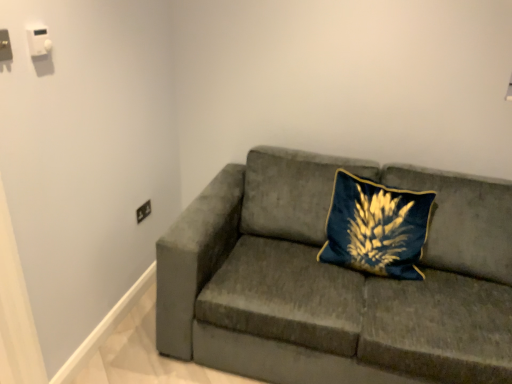
Question: From a real-world perspective, is velvet gray couch at center on top of black plastic electrical outlet at lower left, which ranks as the 3th electric outlet in front-to-back order?

Choices:
 (A) yes
 (B) no

Answer: (B)

Question: From the image's perspective, would you say velvet gray couch at center is shown under black plastic electrical outlet at lower left, marked as the third electric outlet in a top-to-bottom arrangement?

Choices:
 (A) yes
 (B) no

Answer: (A)

Question: Is the position of velvet gray couch at center less distant than that of black plastic electrical outlet at lower left, arranged as the 3th electric outlet when viewed from the left?

Choices:
 (A) no
 (B) yes

Answer: (B)

Question: Is the surface of velvet gray couch at center in direct contact with black plastic electrical outlet at lower left, placed as the first electric outlet when sorted from bottom to top?

Choices:
 (A) no
 (B) yes

Answer: (A)

Question: Would you consider velvet gray couch at center to be distant from black plastic electrical outlet at lower left, arranged as the 3th electric outlet when viewed from the left?

Choices:
 (A) yes
 (B) no

Answer: (A)

Question: Looking at the image, does white plastic switch at upper left, which is the second electric outlet from right to left, seem bigger or smaller compared to black plastic electrical outlet at lower left, which ranks as the 3th electric outlet in front-to-back order?

Choices:
 (A) small
 (B) big

Answer: (A)

Question: In the image, is white plastic switch at upper left, which ranks as the 2th electric outlet in left-to-right order, positioned in front of or behind black plastic electrical outlet at lower left, arranged as the 3th electric outlet when viewed from the left?

Choices:
 (A) behind
 (B) front

Answer: (B)

Question: Considering the positions of white plastic switch at upper left, acting as the second electric outlet starting from the back, and black plastic electrical outlet at lower left, marked as the third electric outlet in a top-to-bottom arrangement, in the image, is white plastic switch at upper left, acting as the second electric outlet starting from the back, wider or thinner than black plastic electrical outlet at lower left, marked as the third electric outlet in a top-to-bottom arrangement,?

Choices:
 (A) wide
 (B) thin

Answer: (A)

Question: Visually, is white plastic switch at upper left, placed as the first electric outlet when sorted from top to bottom, positioned to the left or to the right of black plastic electrical outlet at lower left, placed as the first electric outlet when sorted from bottom to top?

Choices:
 (A) right
 (B) left

Answer: (B)

Question: Which is correct: matte black socket at upper left, the second electric outlet viewed from the top, is inside velvet gray couch at center, or outside of it?

Choices:
 (A) inside
 (B) outside

Answer: (B)

Question: In the image, is matte black socket at upper left, positioned as the 1th electric outlet in left-to-right order, positioned in front of or behind velvet gray couch at center?

Choices:
 (A) front
 (B) behind

Answer: (B)

Question: From the image's perspective, is matte black socket at upper left, which ranks as the 3th electric outlet in back-to-front order, above or below velvet gray couch at center?

Choices:
 (A) above
 (B) below

Answer: (A)

Question: Is matte black socket at upper left, marked as the 2th electric outlet in a bottom-to-top arrangement, taller or shorter than velvet gray couch at center?

Choices:
 (A) tall
 (B) short

Answer: (B)

Question: From the image's perspective, is black plastic electrical outlet at lower left, which ranks as the 3th electric outlet in front-to-back order, located above or below matte black socket at upper left, which ranks as the 3th electric outlet in back-to-front order?

Choices:
 (A) below
 (B) above

Answer: (A)

Question: Based on their positions, is black plastic electrical outlet at lower left, which ranks as the 3th electric outlet in front-to-back order, located to the left or right of matte black socket at upper left, positioned as the 1th electric outlet in left-to-right order?

Choices:
 (A) left
 (B) right

Answer: (B)